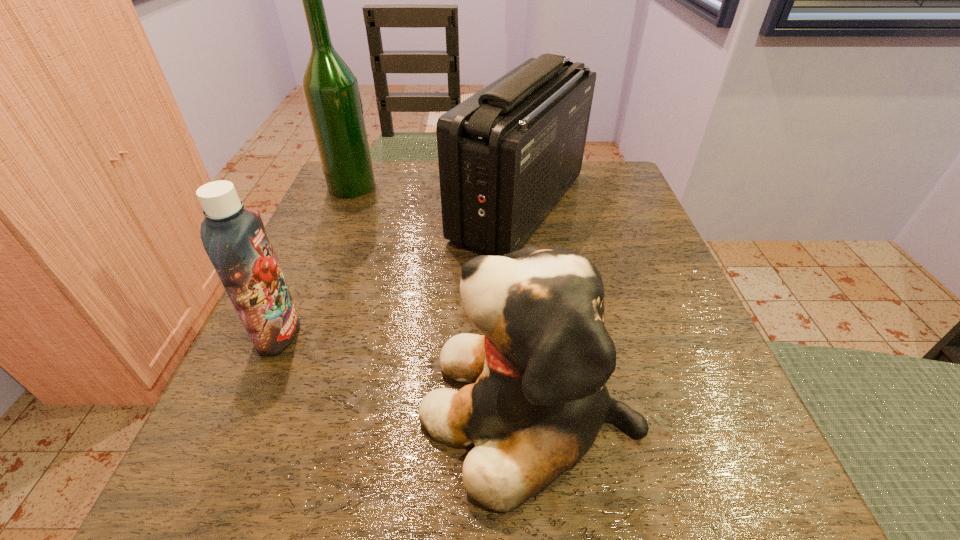
Locate an element on the screen. This screenshot has height=540, width=960. unoccupied position between the tallest object and the radio receiver is located at coordinates (436, 196).

You are a GUI agent. You are given a task and a screenshot of the screen. Output one action in this format:
    pyautogui.click(x=<x>, y=<y>)
    Task: Click on the free spot between the puppy and the alcohol
    This screenshot has height=540, width=960.
    Given the screenshot: What is the action you would take?
    pyautogui.click(x=441, y=297)

Identify the location of vacant area between the shampoo and the radio receiver. The image size is (960, 540). (399, 269).

Find the location of `free spot between the shampoo and the radio receiver`. free spot between the shampoo and the radio receiver is located at coordinates (399, 269).

Locate which object is the closest to the puppy. Please provide its 2D coordinates. Your answer should be formatted as a tuple, i.e. [(x, y)], where the tuple contains the x and y coordinates of a point satisfying the conditions above.

[(507, 155)]

Point out which object is positioned as the second nearest to the alcohol. Please provide its 2D coordinates. Your answer should be formatted as a tuple, i.e. [(x, y)], where the tuple contains the x and y coordinates of a point satisfying the conditions above.

[(235, 239)]